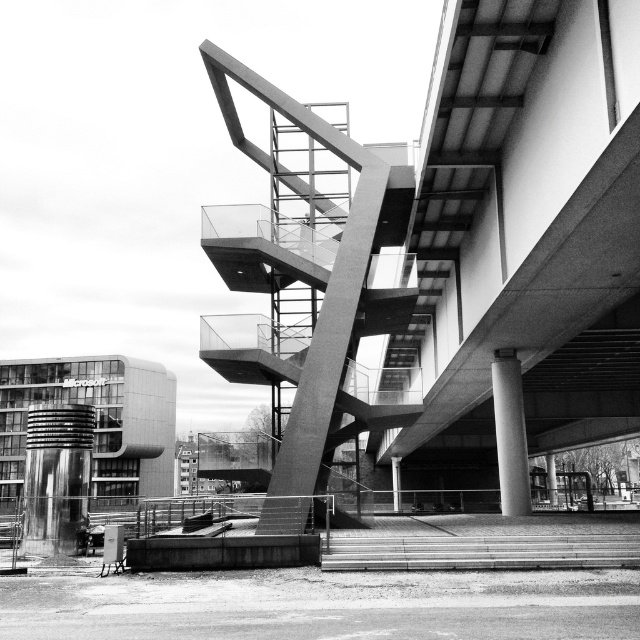
Is smooth concrete staircase at center above polished metal cylinder at left?

Yes, smooth concrete staircase at center is above polished metal cylinder at left.

This screenshot has height=640, width=640. What do you see at coordinates (461, 250) in the screenshot?
I see `smooth concrete staircase at center` at bounding box center [461, 250].

Locate an element on the screen. This screenshot has width=640, height=640. smooth concrete staircase at center is located at coordinates (461, 250).

Can you confirm if smooth concrete staircase at center is wider than metallic cylindrical pillar at lower left?

Yes, smooth concrete staircase at center is wider than metallic cylindrical pillar at lower left.

Is point (483, 374) positioned in front of point (60, 497)?

No, (483, 374) is behind (60, 497).

Is point (460, 246) positioned behind point (35, 458)?

Yes.

Where is `smooth concrete staircase at center`? This screenshot has height=640, width=640. smooth concrete staircase at center is located at coordinates (461, 250).

Describe the element at coordinates (550, 477) in the screenshot. I see `smooth concrete pillar at center` at that location.

Who is shorter, smooth concrete pillar at center or concrete pillar at center?

Standing shorter between the two is smooth concrete pillar at center.

Is point (547, 460) closer to camera compared to point (396, 472)?

No, it is behind (396, 472).

Locate an element on the screen. smooth concrete pillar at center is located at coordinates (550, 477).